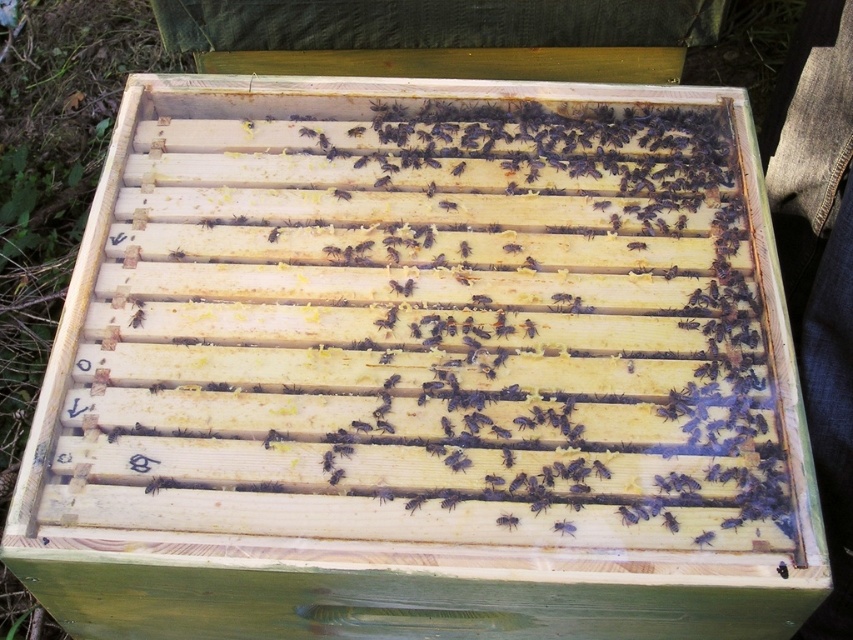
Question: Which object appears closest to the camera in this image?

Choices:
 (A) black matte bee at center
 (B) black fuzzy bee at center

Answer: (B)

Question: Which point is farther to the camera?

Choices:
 (A) (567, 534)
 (B) (498, 524)

Answer: (B)

Question: Is black matte bee at center closer to camera compared to black fuzzy bee at center?

Choices:
 (A) yes
 (B) no

Answer: (B)

Question: Which point is farther from the camera taking this photo?

Choices:
 (A) (497, 524)
 (B) (560, 532)

Answer: (A)

Question: Is black matte bee at center to the right of black fuzzy bee at center from the viewer's perspective?

Choices:
 (A) yes
 (B) no

Answer: (B)

Question: Can you confirm if black matte bee at center is positioned to the left of black fuzzy bee at center?

Choices:
 (A) yes
 (B) no

Answer: (A)